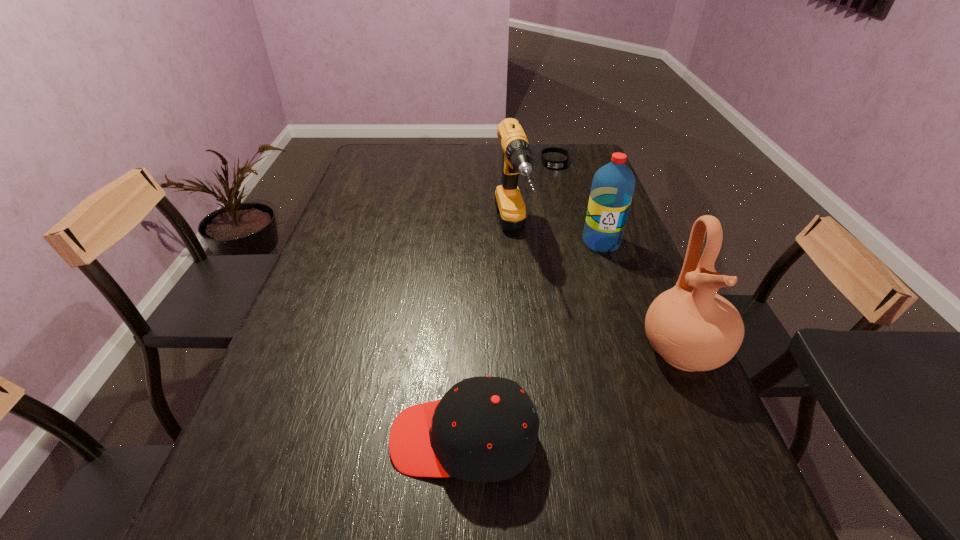
Identify the location of free spot between the pottery and the drill. (596, 293).

Locate an element on the screen. The image size is (960, 540). free space between the second nearest object and the drill is located at coordinates (596, 293).

Locate an element on the screen. The width and height of the screenshot is (960, 540). free space that is in between the nearest object and the water bottle is located at coordinates (532, 340).

You are a GUI agent. You are given a task and a screenshot of the screen. Output one action in this format:
    pyautogui.click(x=<x>, y=<y>)
    Task: Click on the empty space between the pottery and the water bottle
    
    Given the screenshot: What is the action you would take?
    pyautogui.click(x=641, y=296)

Locate an element on the screen. The width and height of the screenshot is (960, 540). free space that is in between the pottery and the water bottle is located at coordinates (641, 296).

You are a GUI agent. You are given a task and a screenshot of the screen. Output one action in this format:
    pyautogui.click(x=<x>, y=<y>)
    Task: Click on the empty space that is in between the cap and the drill
    This screenshot has height=540, width=960.
    Given the screenshot: What is the action you would take?
    pyautogui.click(x=488, y=336)

Identify the location of vacant area that lies between the drill and the water bottle. (556, 239).

Where is `free point between the wristband and the nearest object`? This screenshot has width=960, height=540. free point between the wristband and the nearest object is located at coordinates (509, 300).

The image size is (960, 540). I want to click on vacant space that's between the wristband and the pottery, so click(618, 256).

Where is `unoccupied area between the water bottle and the drill`? The image size is (960, 540). unoccupied area between the water bottle and the drill is located at coordinates (556, 239).